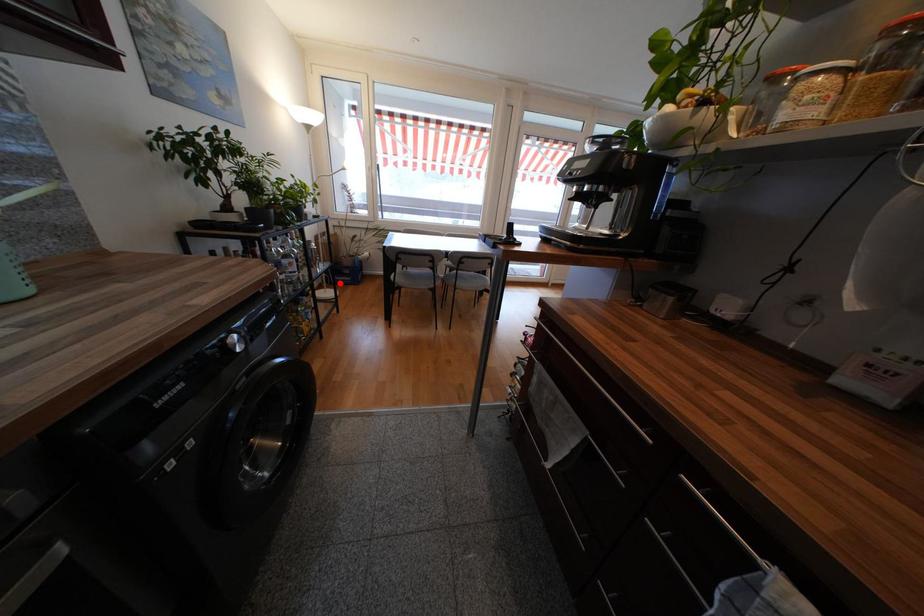
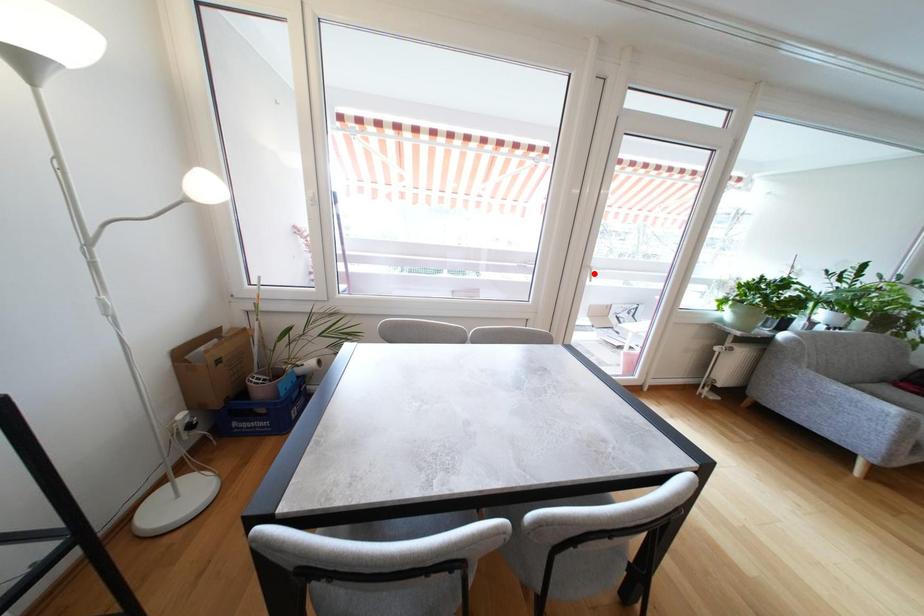
I am providing you with two images of the same scene from different viewpoints. A red point is marked on the first image and another point is marked on the second image. Do the highlighted points in image1 and image2 indicate the same real-world spot?

No